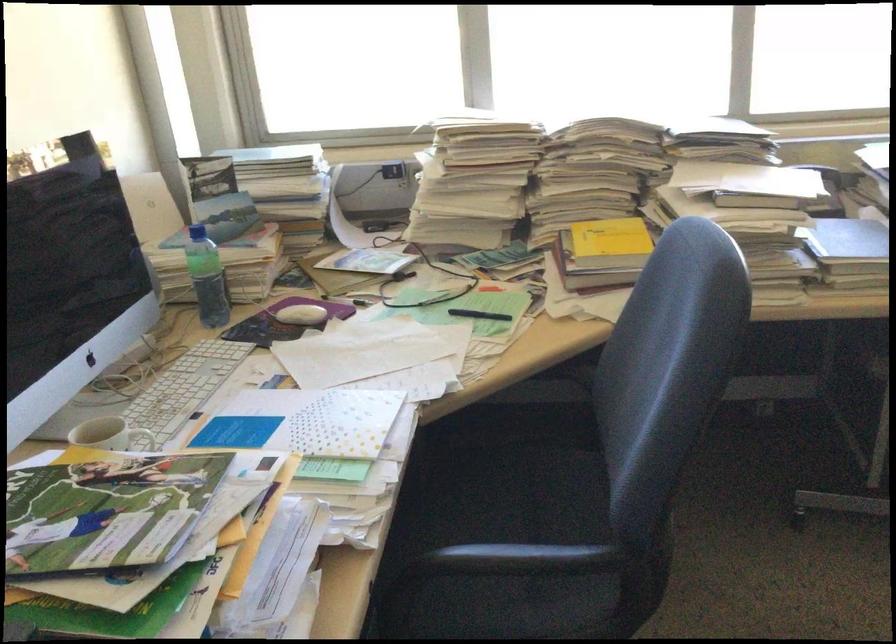
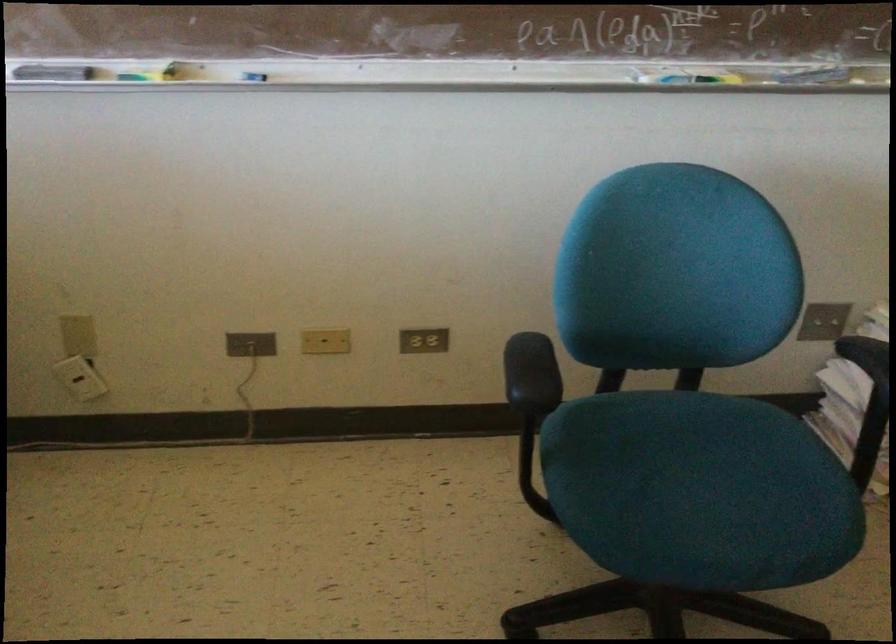
Based on the continuous images, in which direction is the camera rotating?

The camera's rotation is toward right-down.